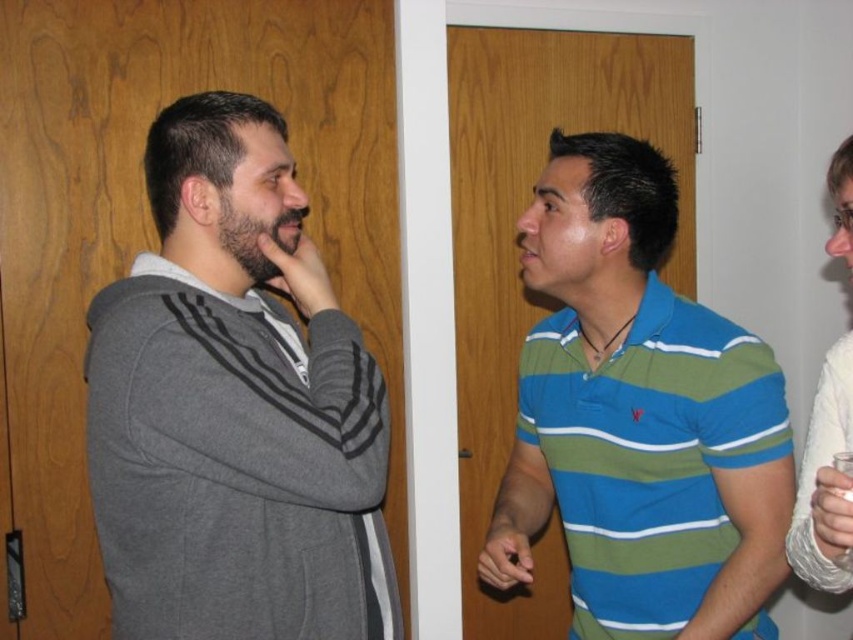
Does point (234, 333) come closer to viewer compared to point (701, 305)?

Yes.

Does point (329, 456) lie behind point (770, 480)?

No.

Who is more forward, (169, 589) or (601, 593)?

Point (169, 589)

Identify the location of gray fleece jacket at left. This screenshot has width=853, height=640. (234, 406).

Is striped cotton polo shirt at center taller than white textured fabric at right?

Correct, striped cotton polo shirt at center is much taller as white textured fabric at right.

Is striped cotton polo shirt at center thinner than white textured fabric at right?

No, striped cotton polo shirt at center is not thinner than white textured fabric at right.

Which is in front, point (575, 401) or point (830, 248)?

Point (830, 248) is more forward.

The width and height of the screenshot is (853, 640). What are the coordinates of `striped cotton polo shirt at center` in the screenshot? It's located at (637, 417).

Can you confirm if gray fleece jacket at left is bigger than white textured fabric at right?

Indeed, gray fleece jacket at left has a larger size compared to white textured fabric at right.

Does gray fleece jacket at left appear on the right side of white textured fabric at right?

Incorrect, gray fleece jacket at left is not on the right side of white textured fabric at right.

Is point (178, 419) farther from camera compared to point (834, 403)?

That is False.

Locate an element on the screen. gray fleece jacket at left is located at coordinates (234, 406).